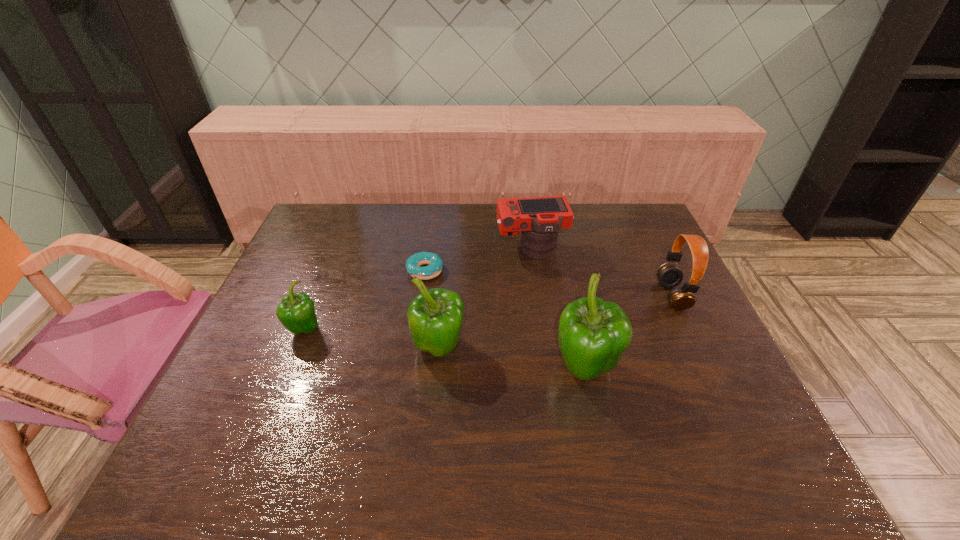
This screenshot has height=540, width=960. I want to click on free space between the rightmost bell pepper and the shortest object, so click(505, 320).

At what (x,y) coordinates should I click in order to perform the action: click on free space between the leftmost bell pepper and the headset. Please return your answer as a coordinate pair (x, y). Looking at the image, I should click on (488, 313).

Image resolution: width=960 pixels, height=540 pixels. What are the coordinates of `empty space between the rightmost bell pepper and the camera` in the screenshot? It's located at point(559,309).

The height and width of the screenshot is (540, 960). I want to click on object that stands as the third closest to the camera, so click(435, 317).

Select which object is the second closest to the rightmost bell pepper. Please provide its 2D coordinates. Your answer should be formatted as a tuple, i.e. [(x, y)], where the tuple contains the x and y coordinates of a point satisfying the conditions above.

[(435, 317)]

Identify which bell pepper is the third nearest to the camera. Please provide its 2D coordinates. Your answer should be formatted as a tuple, i.e. [(x, y)], where the tuple contains the x and y coordinates of a point satisfying the conditions above.

[(296, 312)]

Identify which bell pepper is located as the second nearest to the rightmost bell pepper. Please provide its 2D coordinates. Your answer should be formatted as a tuple, i.e. [(x, y)], where the tuple contains the x and y coordinates of a point satisfying the conditions above.

[(296, 312)]

Where is `free point that satisfies the following two spatial constraints: 1. on the back side of the leftmost object; 2. on the left side of the camera`? The image size is (960, 540). free point that satisfies the following two spatial constraints: 1. on the back side of the leftmost object; 2. on the left side of the camera is located at coordinates (336, 250).